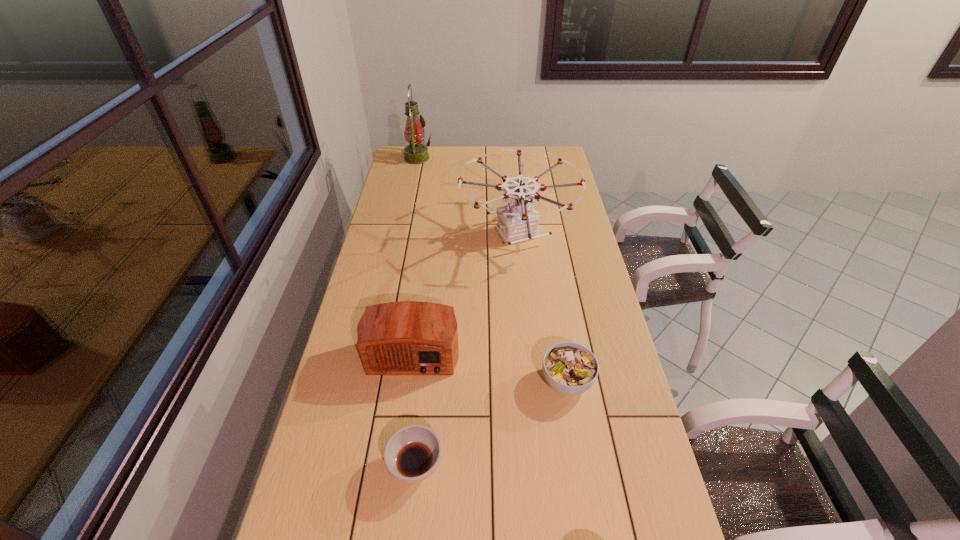
This screenshot has width=960, height=540. Identify the location of vacant area situated 0.140m on the left of the nearest object. (333, 467).

Find the location of a particular element. Image resolution: width=960 pixels, height=540 pixels. object situated at the far edge is located at coordinates (415, 153).

At what (x,y) coordinates should I click in order to perform the action: click on oil lamp present at the left edge. Please return your answer as a coordinate pair (x, y). The height and width of the screenshot is (540, 960). Looking at the image, I should click on (415, 153).

Locate an element on the screen. The image size is (960, 540). radio receiver that is at the left edge is located at coordinates (408, 337).

Where is `drone that is at the right edge`? drone that is at the right edge is located at coordinates (517, 222).

You are a GUI agent. You are given a task and a screenshot of the screen. Output one action in this format:
    pyautogui.click(x=<x>, y=<y>)
    Task: Click on the soup bowl positioned at the right edge
    
    Given the screenshot: What is the action you would take?
    pyautogui.click(x=569, y=368)

The height and width of the screenshot is (540, 960). Identify the location of object at the far left corner. (415, 153).

The height and width of the screenshot is (540, 960). I want to click on vacant space at the far edge of the desktop, so click(x=512, y=161).

Find the location of a particular element. Image resolution: width=960 pixels, height=540 pixels. free spot at the left edge of the desktop is located at coordinates (381, 293).

Where is `vacant space at the right edge`? vacant space at the right edge is located at coordinates (633, 394).